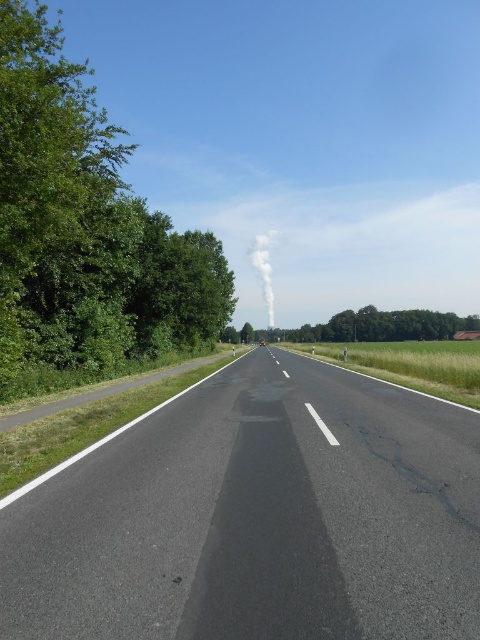
Between green leafy tree at left and white smoke at center, which one appears on the left side from the viewer's perspective?

green leafy tree at left

Based on the photo, which is below, green leafy tree at left or white smoke at center?

white smoke at center is below.

Locate an element on the screen. green leafy tree at left is located at coordinates (84, 227).

Identify the location of green leafy tree at left. (84, 227).

Is black asphalt road at center closer to camera compared to green leafy tree at left?

That is True.

Which of these two, black asphalt road at center or green leafy tree at left, stands taller?

green leafy tree at left is taller.

Measure the distance between point [219,384] and camera.

They are 21.36 meters apart.

You are a GUI agent. You are given a task and a screenshot of the screen. Output one action in this format:
    pyautogui.click(x=<x>, y=<y>)
    Task: Click on the black asphalt road at center
    The width and height of the screenshot is (480, 640).
    Given the screenshot: What is the action you would take?
    pyautogui.click(x=257, y=516)

Describe the element at coordinates (84, 227) in the screenshot. I see `green leafy tree at left` at that location.

Is point (69, 252) positioned before point (347, 330)?

Yes, point (69, 252) is closer to viewer.

Find the location of `green leafy tree at left`. green leafy tree at left is located at coordinates (84, 227).